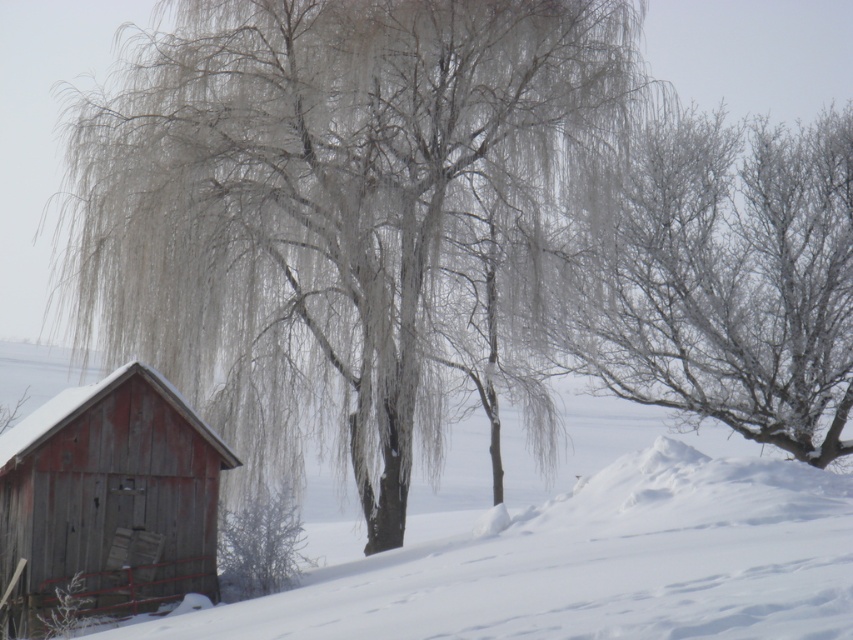
You are an observer standing in the winter scene. You notice the white fluffy snow at lower left and the frosted branches at center. Which object is closer to you?

The white fluffy snow at lower left is closer to you because it is in front of the frosted branches at center.